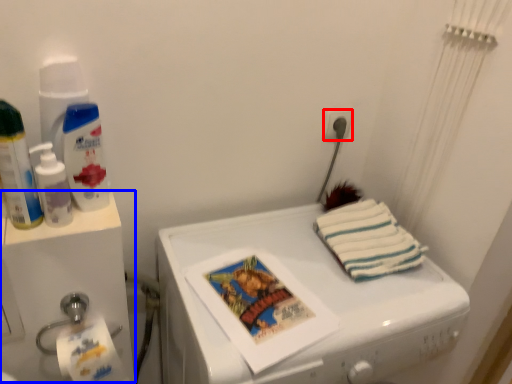
Question: Which of the following is the farthest to the observer, power plugs and sockets (highlighted by a red box) or water cooler (highlighted by a blue box)?

Choices:
 (A) power plugs and sockets
 (B) water cooler

Answer: (A)